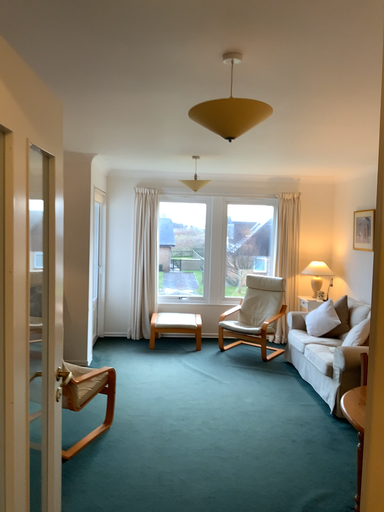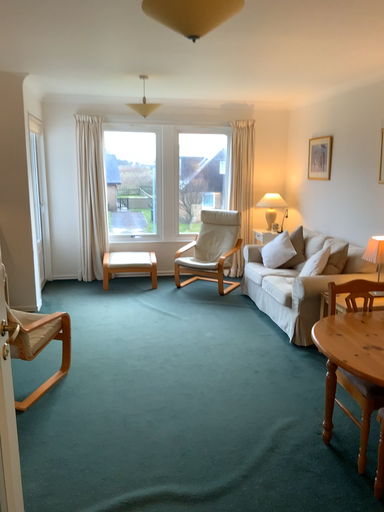
Question: Which way did the camera rotate in the video?

Choices:
 (A) rotated right
 (B) rotated left

Answer: (A)